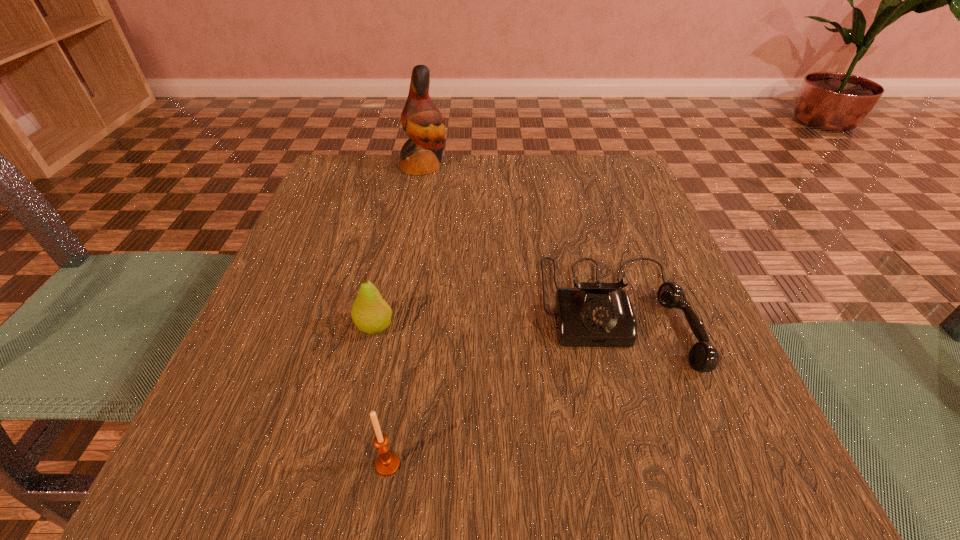
Find the location of `object that is the third closest to the nearest object`. object that is the third closest to the nearest object is located at coordinates (421, 120).

Where is `object that is the third closest one to the tallest object`? The width and height of the screenshot is (960, 540). object that is the third closest one to the tallest object is located at coordinates (387, 463).

Locate an element on the screen. This screenshot has height=540, width=960. free location that satisfies the following two spatial constraints: 1. on the back side of the candle_holder; 2. on the face of the parrot is located at coordinates (434, 166).

Locate an element on the screen. This screenshot has height=540, width=960. vacant space that satisfies the following two spatial constraints: 1. on the face of the nearest object; 2. on the left side of the parrot is located at coordinates (369, 464).

Find the location of `free space in the image that satisfies the following two spatial constraints: 1. on the back side of the candle_holder; 2. on the face of the farthest object`. free space in the image that satisfies the following two spatial constraints: 1. on the back side of the candle_holder; 2. on the face of the farthest object is located at coordinates (434, 166).

Find the location of a particular element. vacant space that satisfies the following two spatial constraints: 1. on the back side of the nearest object; 2. on the face of the tallest object is located at coordinates (434, 166).

You are a GUI agent. You are given a task and a screenshot of the screen. Output one action in this format:
    pyautogui.click(x=<x>, y=<y>)
    Task: Click on the vacant area that satisfies the following two spatial constraints: 1. on the back side of the candle_holder; 2. on the face of the tallest object
    Image resolution: width=960 pixels, height=540 pixels.
    Given the screenshot: What is the action you would take?
    pyautogui.click(x=434, y=166)